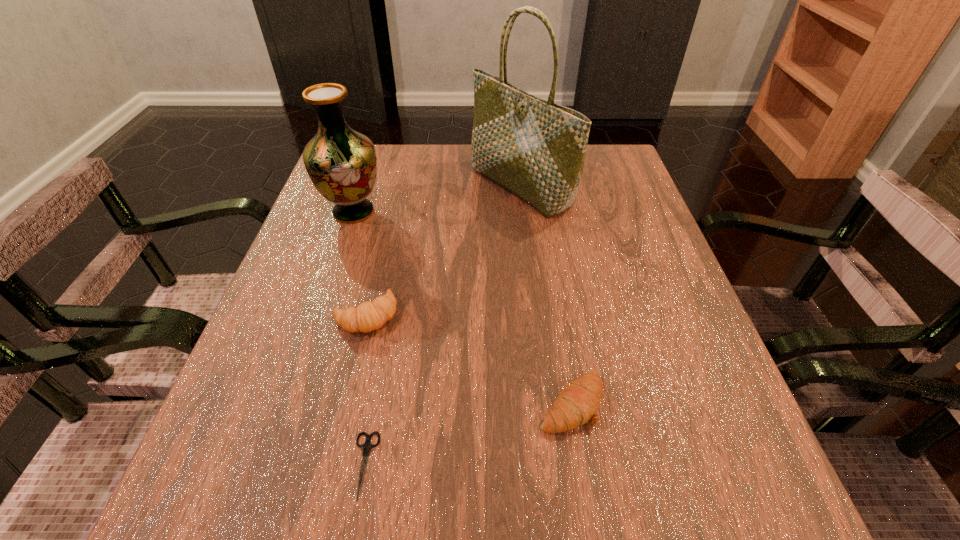
At what (x,y) coordinates should I click in order to perform the action: click on free space between the fourth shortest object and the third farthest object. Please return your answer as a coordinate pair (x, y). This screenshot has width=960, height=540. Looking at the image, I should click on (360, 264).

Locate an element on the screen. This screenshot has width=960, height=540. empty space between the shears and the nearer crescent roll is located at coordinates (468, 434).

Locate an element on the screen. The image size is (960, 540). unoccupied area between the shorter crescent roll and the farther crescent roll is located at coordinates (468, 359).

Find the location of `free space between the tallest object and the left crescent roll`. free space between the tallest object and the left crescent roll is located at coordinates (444, 251).

Select which object is the third closest to the farther crescent roll. Please provide its 2D coordinates. Your answer should be formatted as a tuple, i.e. [(x, y)], where the tuple contains the x and y coordinates of a point satisfying the conditions above.

[(577, 404)]

Identify which object is the second closest to the shopping bag. Please provide its 2D coordinates. Your answer should be formatted as a tuple, i.e. [(x, y)], where the tuple contains the x and y coordinates of a point satisfying the conditions above.

[(368, 316)]

This screenshot has height=540, width=960. Identify the location of free space that satisfies the following two spatial constraints: 1. on the front side of the shorter crescent roll; 2. on the left side of the farther crescent roll. (346, 403).

Image resolution: width=960 pixels, height=540 pixels. Identify the location of vacant position in the image that satisfies the following two spatial constraints: 1. on the front side of the third nearest object; 2. on the right side of the second tallest object. (319, 315).